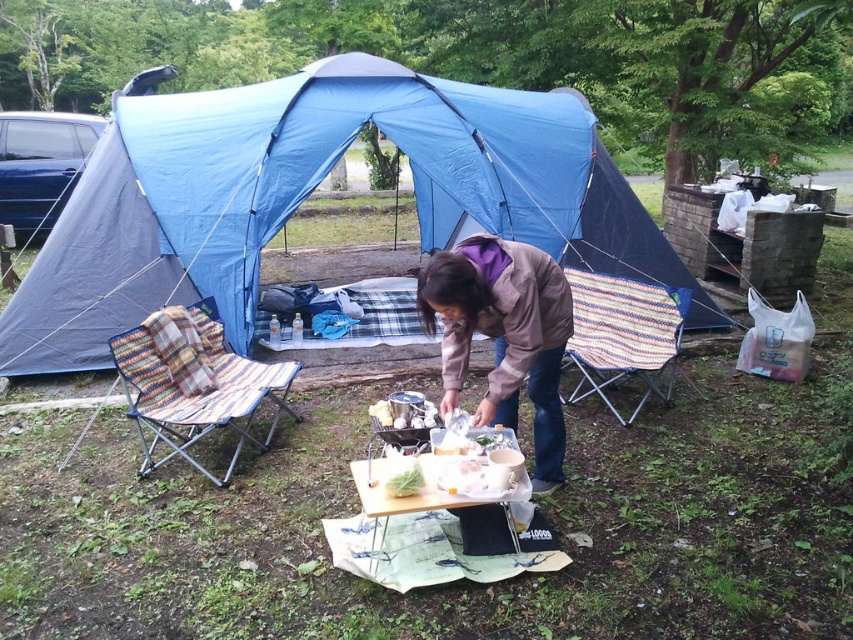
Based on the photo, you are a hiker who wants to sit down and rest. You see the brown fabric jacket at center and the multicolored woven fabric chair at left. Which object is closer to you?

The brown fabric jacket at center is closer to you because it is in front of the multicolored woven fabric chair at left.

You are packing for a camping trip and need to decide which item to place in a narrow backpack compartment. Based on the image, which item between the brown fabric jacket at center and the multicolored woven fabric chair at left is more suitable for the narrow space?

The brown fabric jacket at center is thinner than the multicolored woven fabric chair at left, so it is more suitable for the narrow backpack compartment.